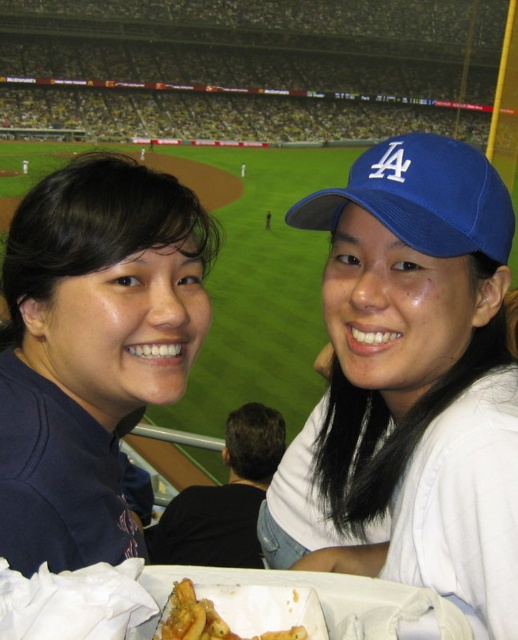
You are a food delivery robot at the baseball stadium. You need to deliver the golden crispy fries at lower center to the person wearing the blue fabric cap at upper right. The robot has a maximum delivery range of 5 feet. Can you reach them?

The distance between the golden crispy fries at lower center and the blue fabric cap at upper right is 4.68 feet, which is within the robot delivery range of 5 feet. Yes, the robot can reach them.

You are a photographer at the baseball stadium and want to take a photo of the blue fabric cap at upper right and the golden crispy fries at lower center. Which object should you focus on first if you want to capture both in the same frame without zooming in or out?

The blue fabric cap at upper right is larger than the golden crispy fries at lower center, so you should focus on the blue fabric cap at upper right first to ensure it fits properly in the frame before adjusting for the smaller fries.